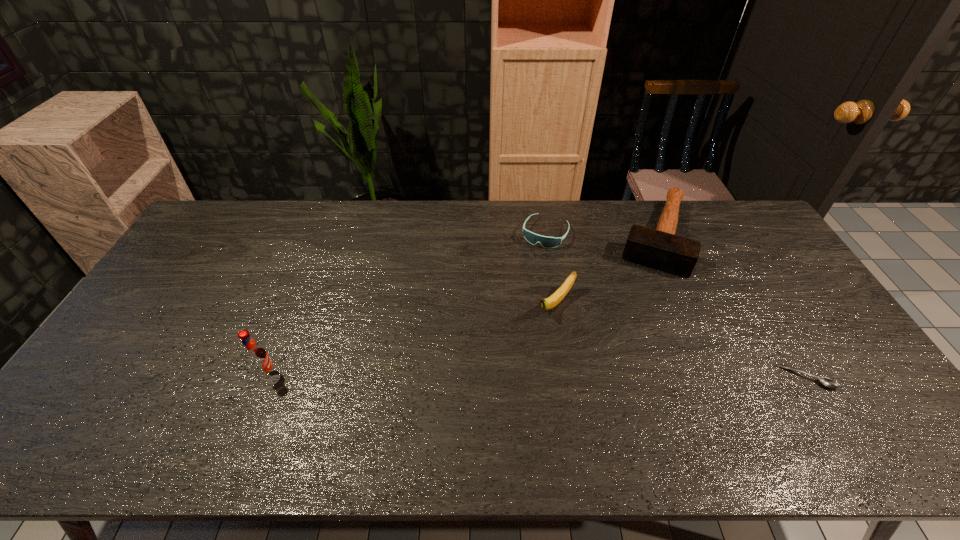
Locate an element on the screen. This screenshot has width=960, height=540. free space between the leftmost object and the fourth object from left to right is located at coordinates (461, 306).

This screenshot has height=540, width=960. What are the coordinates of `blank region between the fourth object from left to right and the banana` in the screenshot? It's located at (606, 270).

Locate an element on the screen. free point between the leftmost object and the third farthest object is located at coordinates (412, 339).

Find the location of a particular element. This screenshot has width=960, height=540. empty location between the second object from right to left and the fourth tallest object is located at coordinates (600, 235).

What are the coordinates of `free space between the mallet and the third nearest object` in the screenshot? It's located at (606, 270).

Image resolution: width=960 pixels, height=540 pixels. What are the coordinates of `vacant area that lies between the rightmost object and the leftmost object` in the screenshot? It's located at (537, 376).

Locate an element on the screen. The width and height of the screenshot is (960, 540). unoccupied position between the third nearest object and the second shortest object is located at coordinates (550, 268).

Locate an element on the screen. Image resolution: width=960 pixels, height=540 pixels. unoccupied position between the soupspoon and the goggles is located at coordinates (676, 305).

Image resolution: width=960 pixels, height=540 pixels. What are the coordinates of `object that is the closest to the third farthest object` in the screenshot? It's located at (x=547, y=242).

Where is `the closest object to the root beer`? Image resolution: width=960 pixels, height=540 pixels. the closest object to the root beer is located at coordinates (549, 303).